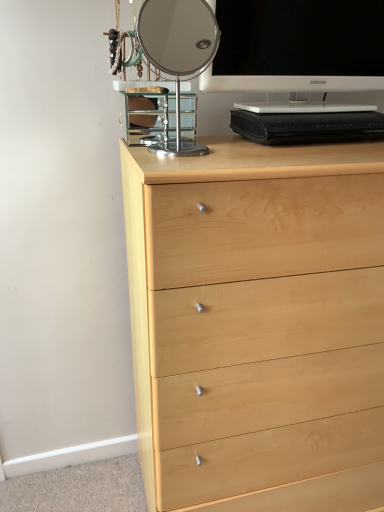
Question: Is light wood chest of drawers at center directly adjacent to white glossy television at upper right?

Choices:
 (A) no
 (B) yes

Answer: (A)

Question: From a real-world perspective, is light wood chest of drawers at center beneath white glossy television at upper right?

Choices:
 (A) yes
 (B) no

Answer: (A)

Question: Is white glossy television at upper right surrounded by light wood chest of drawers at center?

Choices:
 (A) yes
 (B) no

Answer: (B)

Question: Considering the relative positions of light wood chest of drawers at center and white glossy television at upper right in the image provided, is light wood chest of drawers at center to the left of white glossy television at upper right from the viewer's perspective?

Choices:
 (A) yes
 (B) no

Answer: (A)

Question: Is the depth of light wood chest of drawers at center greater than that of white glossy television at upper right?

Choices:
 (A) no
 (B) yes

Answer: (A)

Question: Would you say natural wood drawer at lower center is inside or outside white glossy television at upper right?

Choices:
 (A) outside
 (B) inside

Answer: (A)

Question: In terms of height, does natural wood drawer at lower center look taller or shorter compared to white glossy television at upper right?

Choices:
 (A) tall
 (B) short

Answer: (B)

Question: In terms of width, does natural wood drawer at lower center look wider or thinner when compared to white glossy television at upper right?

Choices:
 (A) wide
 (B) thin

Answer: (A)

Question: Considering the positions of point (286, 471) and point (342, 108), is point (286, 471) closer or farther from the camera than point (342, 108)?

Choices:
 (A) closer
 (B) farther

Answer: (B)

Question: From a real-world perspective, is light wood chest of drawers at center positioned above or below polished chrome mirror at upper center?

Choices:
 (A) below
 (B) above

Answer: (A)

Question: Is light wood chest of drawers at center wider or thinner than polished chrome mirror at upper center?

Choices:
 (A) thin
 (B) wide

Answer: (B)

Question: Is point (243, 268) closer or farther from the camera than point (147, 45)?

Choices:
 (A) closer
 (B) farther

Answer: (A)

Question: Based on their sizes in the image, would you say light wood chest of drawers at center is bigger or smaller than polished chrome mirror at upper center?

Choices:
 (A) big
 (B) small

Answer: (A)

Question: In the image, is white glossy television at upper right on the left side or the right side of polished chrome mirror at upper center?

Choices:
 (A) right
 (B) left

Answer: (A)

Question: From the image's perspective, is white glossy television at upper right above or below polished chrome mirror at upper center?

Choices:
 (A) above
 (B) below

Answer: (A)